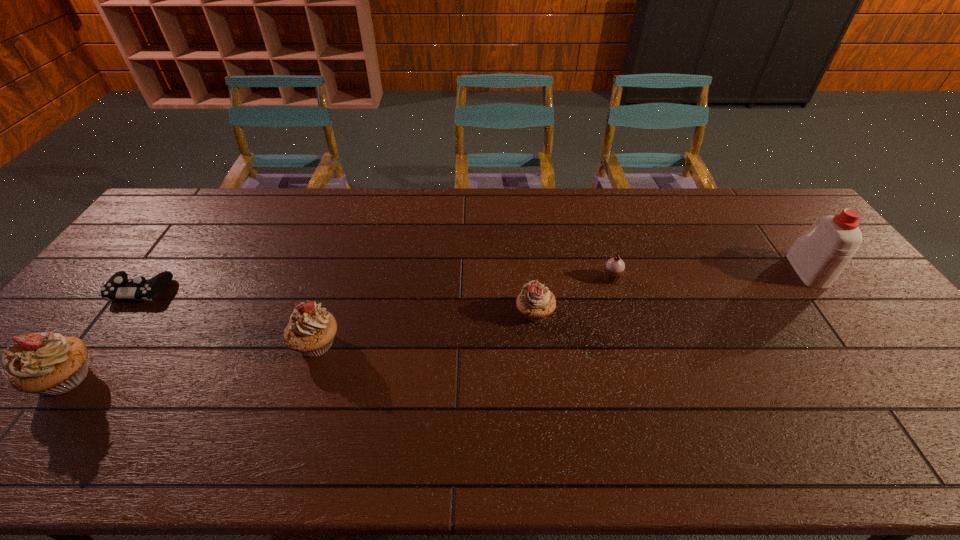
Where is `vacant area that lies between the third tallest cupcake and the third tallest object`? The height and width of the screenshot is (540, 960). vacant area that lies between the third tallest cupcake and the third tallest object is located at coordinates (425, 328).

Locate an element on the screen. Image resolution: width=960 pixels, height=540 pixels. free space between the detergent and the shortest object is located at coordinates (473, 280).

You are a GUI agent. You are given a task and a screenshot of the screen. Output one action in this format:
    pyautogui.click(x=<x>, y=<y>)
    Task: Click on the free space between the farthest cupcake and the leftmost cupcake
    
    Given the screenshot: What is the action you would take?
    pyautogui.click(x=339, y=328)

Identify the location of blank region between the fifth object from left to right and the fourth object from right to left. (464, 311).

Locate an element on the screen. The width and height of the screenshot is (960, 540). free space between the farthest cupcake and the third cupcake from right to left is located at coordinates (464, 311).

The height and width of the screenshot is (540, 960). Identify the location of free space between the tallest object and the shortest object. (473, 280).

Where is `the second closest object to the fourth tallest object`? This screenshot has width=960, height=540. the second closest object to the fourth tallest object is located at coordinates (311, 329).

Identify the location of object that is the second closest to the tallest object. (535, 302).

Identify which cupcake is located as the nearest to the leftmost cupcake. Please provide its 2D coordinates. Your answer should be formatted as a tuple, i.e. [(x, y)], where the tuple contains the x and y coordinates of a point satisfying the conditions above.

[(311, 329)]

At what (x,y) coordinates should I click in order to perform the action: click on cupcake that is the second closest to the farthest cupcake. Please return your answer as a coordinate pair (x, y). Looking at the image, I should click on (311, 329).